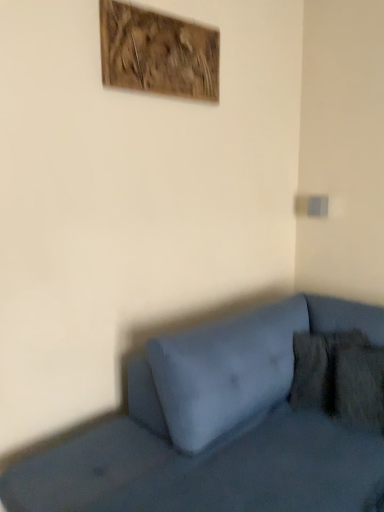
Question: Does matte blue couch at lower right touch wooden textured artwork at upper center?

Choices:
 (A) yes
 (B) no

Answer: (B)

Question: Does matte blue couch at lower right appear on the right side of wooden textured artwork at upper center?

Choices:
 (A) yes
 (B) no

Answer: (A)

Question: Is matte blue couch at lower right facing towards wooden textured artwork at upper center?

Choices:
 (A) yes
 (B) no

Answer: (B)

Question: From a real-world perspective, is matte blue couch at lower right physically above wooden textured artwork at upper center?

Choices:
 (A) no
 (B) yes

Answer: (A)

Question: Considering the relative sizes of matte blue couch at lower right and wooden textured artwork at upper center in the image provided, is matte blue couch at lower right shorter than wooden textured artwork at upper center?

Choices:
 (A) no
 (B) yes

Answer: (A)

Question: Is matte blue couch at lower right smaller than wooden textured artwork at upper center?

Choices:
 (A) no
 (B) yes

Answer: (A)

Question: From the image's perspective, would you say wooden textured artwork at upper center is positioned over matte blue couch at lower right?

Choices:
 (A) no
 (B) yes

Answer: (B)

Question: Can you confirm if wooden textured artwork at upper center is taller than matte blue couch at lower right?

Choices:
 (A) yes
 (B) no

Answer: (B)

Question: From the image's perspective, is wooden textured artwork at upper center below matte blue couch at lower right?

Choices:
 (A) no
 (B) yes

Answer: (A)

Question: Does wooden textured artwork at upper center have a larger size compared to matte blue couch at lower right?

Choices:
 (A) no
 (B) yes

Answer: (A)

Question: Can you confirm if wooden textured artwork at upper center is thinner than matte blue couch at lower right?

Choices:
 (A) yes
 (B) no

Answer: (A)

Question: From a real-world perspective, does wooden textured artwork at upper center stand above matte blue couch at lower right?

Choices:
 (A) no
 (B) yes

Answer: (B)

Question: From a real-world perspective, is velvety brown pillow at lower right physically below matte blue couch at lower right?

Choices:
 (A) yes
 (B) no

Answer: (B)